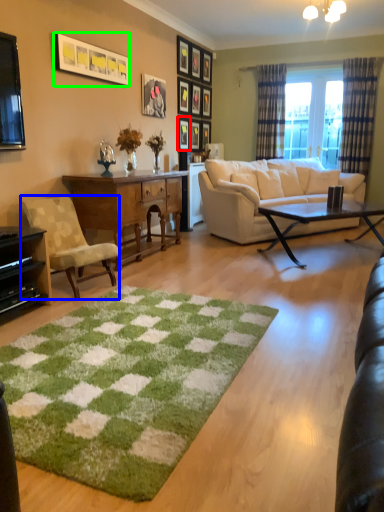
Question: Considering the real-world distances, which object is farthest from picture frame (highlighted by a red box)? chair (highlighted by a blue box) or picture frame (highlighted by a green box)?

Choices:
 (A) chair
 (B) picture frame

Answer: (A)